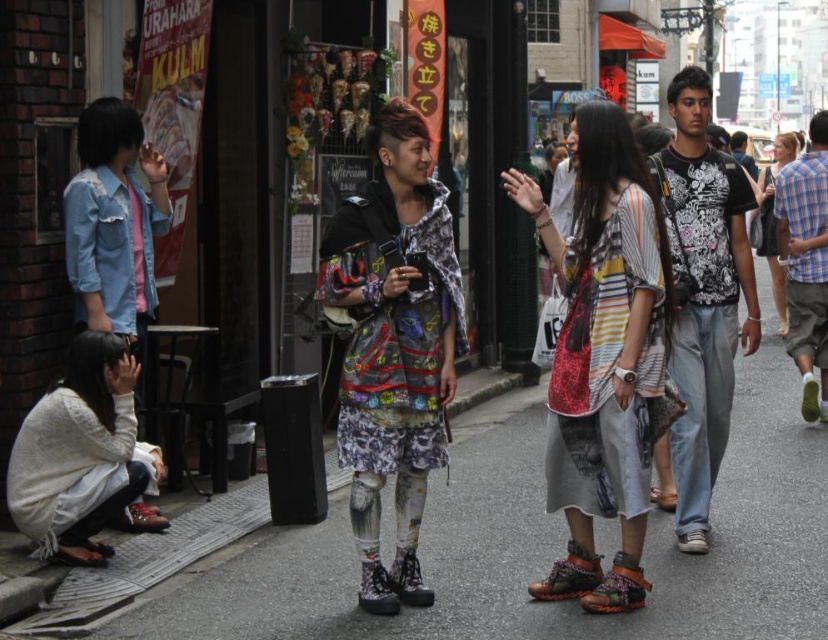
You are a photographer aiming to capture both the striped cotton shirt at center and the printed fabric dress at center in a single shot. Which clothing item should you focus on first to ensure both are in frame?

You should focus on the striped cotton shirt at center first since it is closer to the viewer than the printed fabric dress at center, allowing you to adjust the camera angle to include both in the frame.

You are a photographer trying to capture the matte black shirt at right and the leather textured sandal at lower center in the same frame. Based on their sizes, which object should you focus on first to ensure both fit in the shot?

The matte black shirt at right is thinner than the leather textured sandal at lower center, so you should focus on the leather textured sandal at lower center first to ensure both fit in the shot since it is larger.

You are a photographer standing in the street scene and want to take a photo of the matte black shirt at right and the leather textured sandal at lower center. Which object should you focus on first if you want to capture both in the frame without moving the camera?

The matte black shirt at right is positioned on the right side of the leather textured sandal at lower center, so you should focus on the leather textured sandal at lower center first to ensure both are in frame.